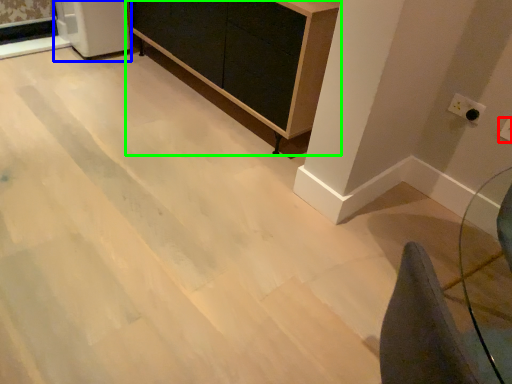
Question: Considering the real-world distances, which object is closest to electric outlet (highlighted by a red box)? appliance (highlighted by a blue box) or furniture (highlighted by a green box).

Choices:
 (A) appliance
 (B) furniture

Answer: (B)